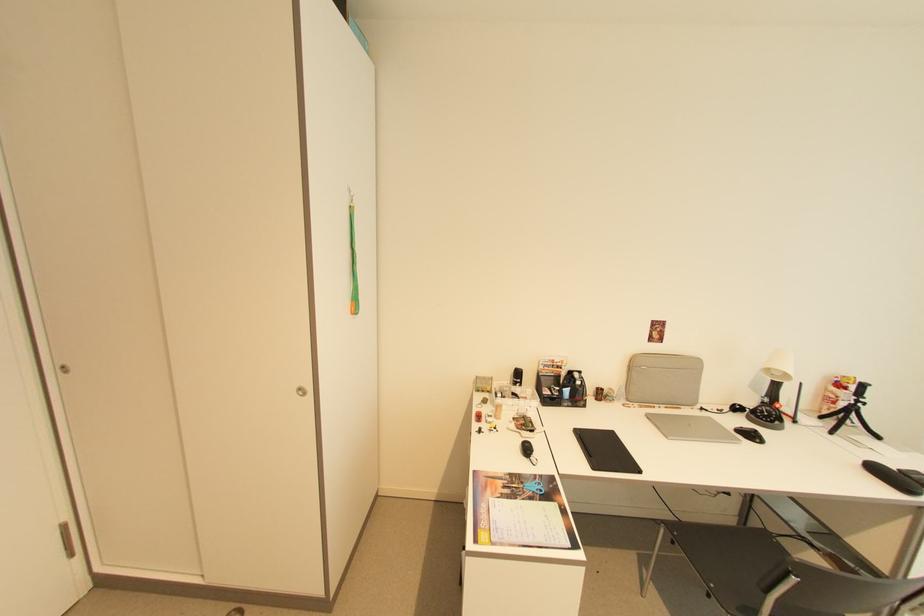
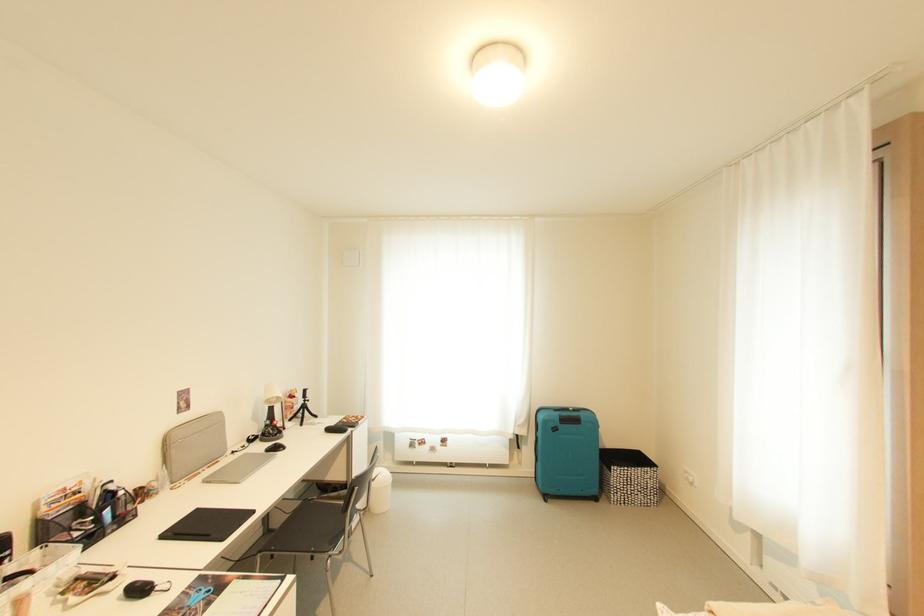
The point at (617, 434) is marked in the first image. Where is the corresponding point in the second image?

(202, 512)